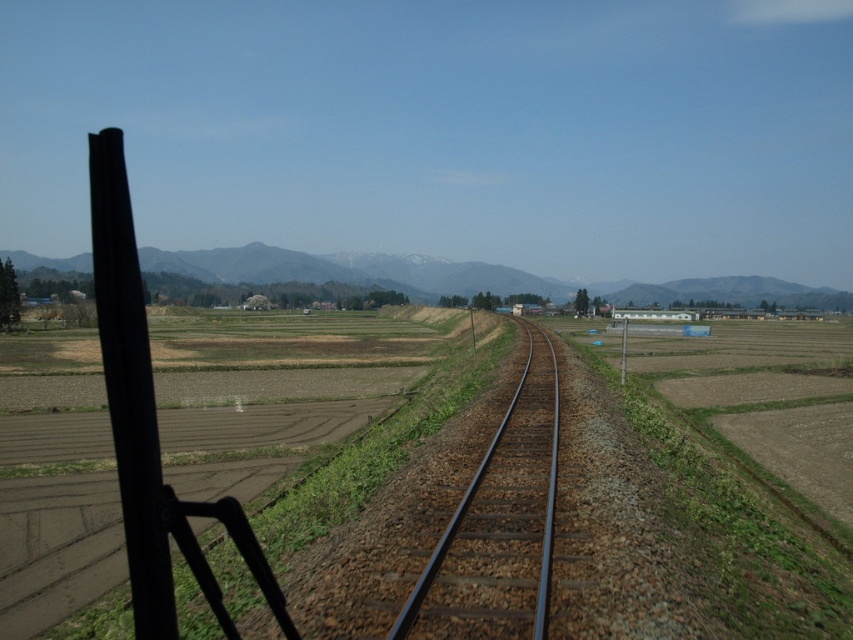
Question: Which point is farther from the camera taking this photo?

Choices:
 (A) (524, 577)
 (B) (708, 284)

Answer: (B)

Question: Observing the image, what is the correct spatial positioning of metallic train track at center in reference to snow-covered mountain at center?

Choices:
 (A) above
 (B) below

Answer: (B)

Question: Is metallic train track at center wider than snow-covered mountain at center?

Choices:
 (A) yes
 (B) no

Answer: (B)

Question: Is metallic train track at center smaller than snow-covered mountain at center?

Choices:
 (A) no
 (B) yes

Answer: (B)